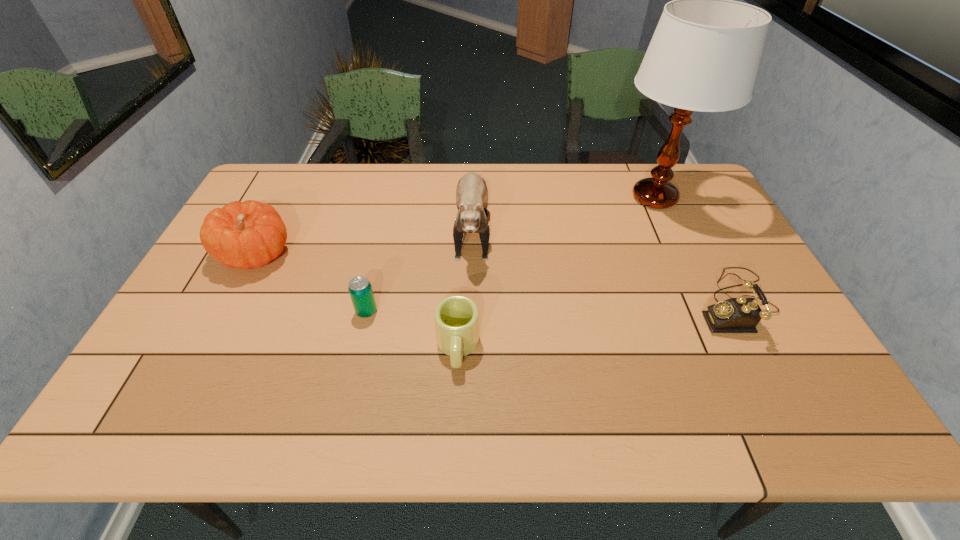
The width and height of the screenshot is (960, 540). I want to click on object at the far right corner, so click(704, 55).

You are a GUI agent. You are given a task and a screenshot of the screen. Output one action in this format:
    pyautogui.click(x=<x>, y=<y>)
    Task: Click on the vacant space at the far edge of the desktop
    This screenshot has height=540, width=960.
    Given the screenshot: What is the action you would take?
    pyautogui.click(x=316, y=179)

The height and width of the screenshot is (540, 960). What are the coordinates of `vacant area at the near edge` in the screenshot? It's located at [x=287, y=436].

The height and width of the screenshot is (540, 960). I want to click on vacant space at the left edge of the desktop, so click(x=227, y=306).

This screenshot has height=540, width=960. I want to click on vacant space at the right edge, so click(x=686, y=212).

I want to click on vacant point at the far left corner, so click(273, 185).

You are a GUI agent. You are given a task and a screenshot of the screen. Output one action in this format:
    pyautogui.click(x=<x>, y=<y>)
    Task: Click on the vacant point located between the leftmost object and the ferret
    Image resolution: width=960 pixels, height=540 pixels.
    Given the screenshot: What is the action you would take?
    tap(364, 240)

The height and width of the screenshot is (540, 960). In order to click on empty space between the mug and the second object from left to right in this screenshot , I will do `click(412, 329)`.

In order to click on free space between the fifth object from right to left and the table lamp in this screenshot , I will do `click(511, 255)`.

I want to click on empty location between the second object from left to right and the fifth shortest object, so click(x=420, y=268).